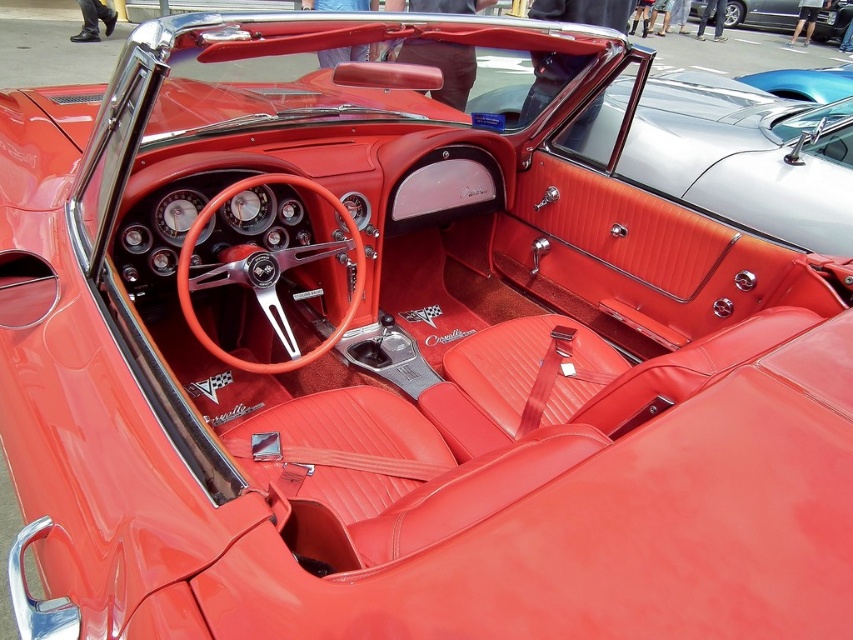
You are a car enthusiast examining the interior of this classic car. You notice the matte red leather door at center and the glossy red leather convertible at upper center. Which object has a greater height?

The matte red leather door at center is taller than the glossy red leather convertible at upper center.